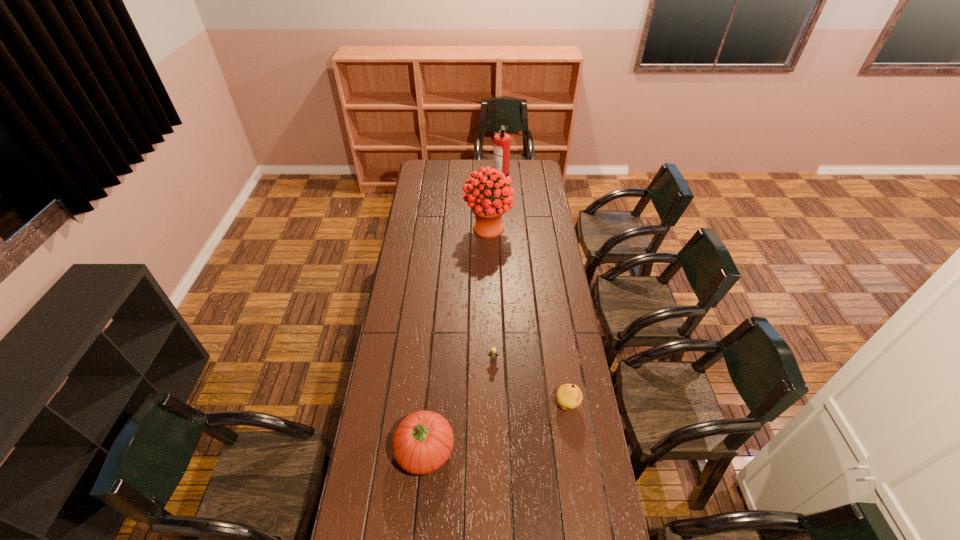
Identify the location of free area in between the shortest object and the third tallest object. (459, 405).

You are a GUI agent. You are given a task and a screenshot of the screen. Output one action in this format:
    pyautogui.click(x=<x>, y=<y>)
    Task: Click on the free space that is in between the third shortest object and the Lego
    
    Given the screenshot: What is the action you would take?
    pyautogui.click(x=459, y=405)

Where is `the fourth closest object to the pumpkin`? This screenshot has width=960, height=540. the fourth closest object to the pumpkin is located at coordinates (502, 140).

At what (x,y) coordinates should I click in order to perform the action: click on object that can be found as the fourth closest to the fire extinguisher. Please return your answer as a coordinate pair (x, y). This screenshot has width=960, height=540. Looking at the image, I should click on (423, 441).

I want to click on free space that satisfies the following two spatial constraints: 1. in front of the Lego; 2. on the left side of the rightmost object, so click(494, 405).

Locate an element on the screen. The width and height of the screenshot is (960, 540). vacant space that satisfies the following two spatial constraints: 1. in front of the shortest object; 2. on the left side of the pear is located at coordinates (494, 405).

Identify the location of vacant space that satisfies the following two spatial constraints: 1. on the front-facing side of the farthest object; 2. on the right side of the rightmost object. (515, 405).